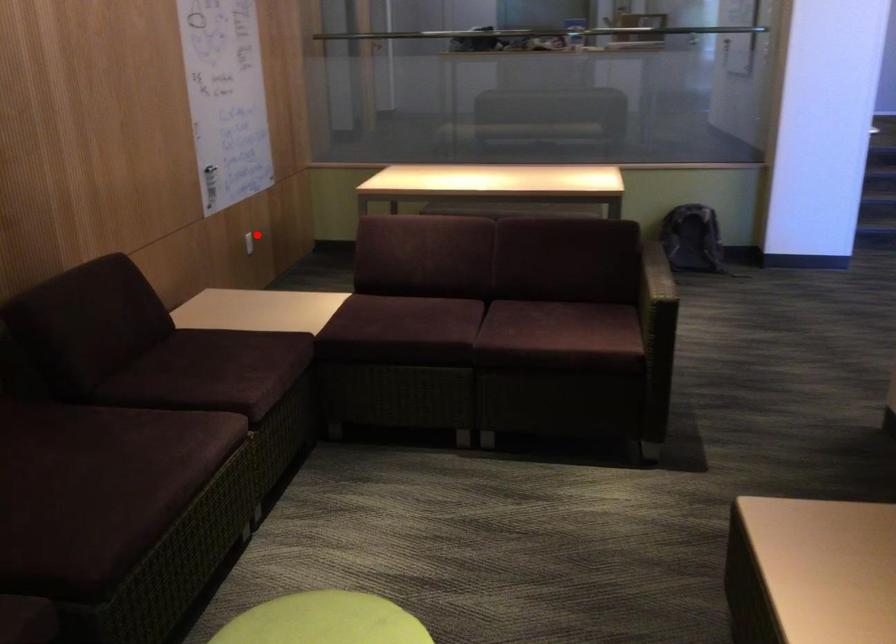
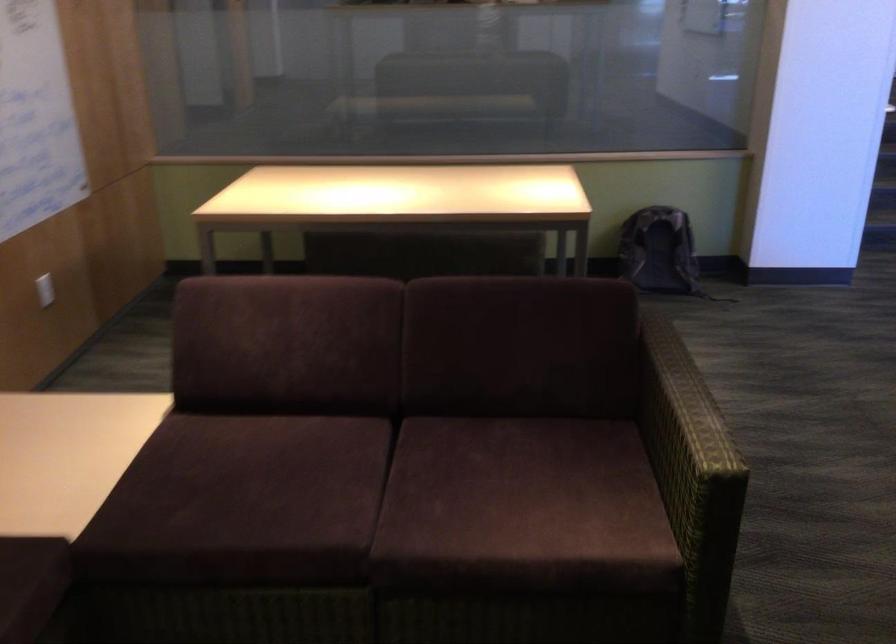
Locate, in the second image, the point that corresponds to the highlighted location in the first image.

(45, 289)